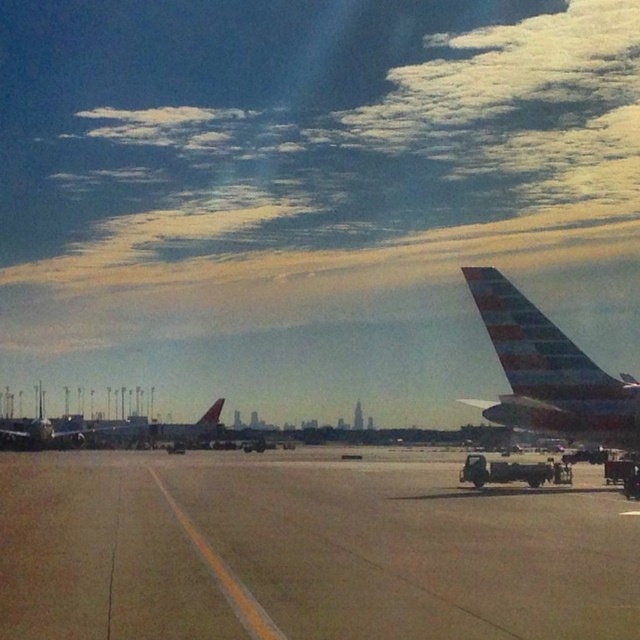
You are a drone operator trying to navigate a drone between two points in the airport image. The first point is at coordinates point [476,596] and the second is at point [65,428]. Given that the drone has a maximum flight altitude of 1 meter, which point should you choose to ensure the drone stays above the airplane wing visible in the image?

Point [476,596] is closer to the camera than point [65,428]. Since the airplane wing is in the foreground on the right side of the frame, the point closer to the camera would be above the wing. Therefore, choosing point [476,596] ensures the drone stays above the airplane wing at a safe altitude of 1 meter.

You are a maintenance worker at the airport and need to inspect the polished aluminum airplane wing at right. Your ladder is 20 feet long. Can you reach the wing with your ladder?

The polished aluminum airplane wing at right is 67.28 feet away from the camera, which is much farther than the 20 feet length of the ladder. Therefore, the ladder is not long enough to reach the wing.

You are standing at the point marked as point (576, 394) on the airport tarmac. The airport has a rule that no one can be closer than 25 meters to any aircraft. Is your current position compliant with this rule?

The distance between point (576, 394) and the viewer is 20.86 meters, which is less than the required 25 meters. Therefore, your current position is not compliant with the airport rule.